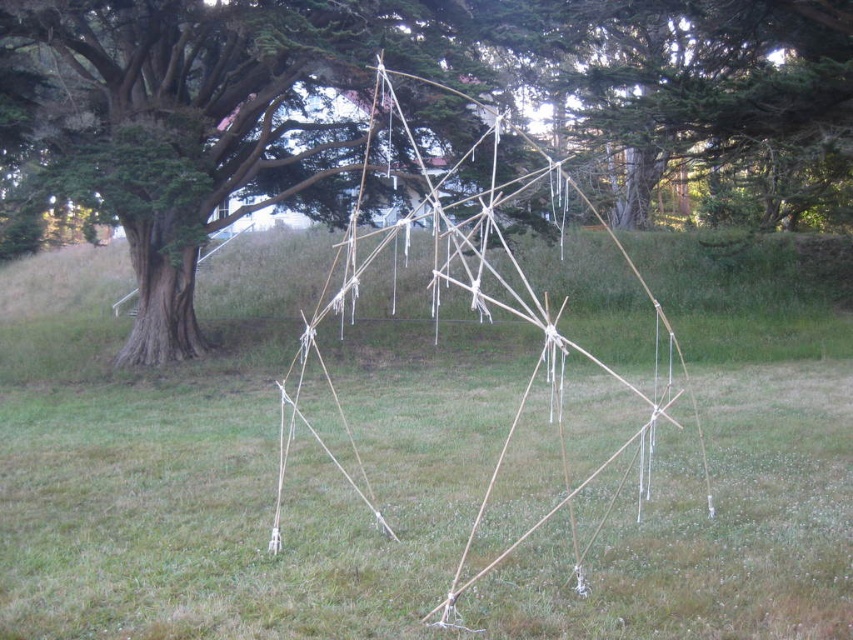
You are standing in the middle of the grassy area and see the brown wood tree at center and the natural wood stick structure at center. Which object is located higher above the ground?

The brown wood tree at center is positioned over the natural wood stick structure at center, so it is higher above the ground.

You are trying to set up a small picnic blanket in the green grass at center. There is also a natural wood stick structure at center nearby. Can the picnic blanket fit between them without overlapping?

The green grass at center might be wider than natural wood stick structure at center, so there might be enough space to place the picnic blanket between them without overlapping. However, the exact width difference isn